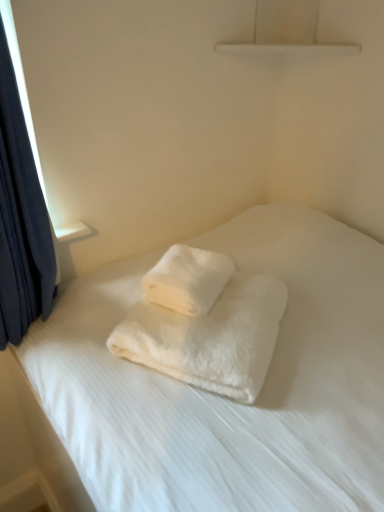
Question: Is white fluffy towel at center, which ranks as the 2th towel in bottom-to-top order, bigger than white fluffy towel at center, the second towel when ordered from top to bottom?

Choices:
 (A) yes
 (B) no

Answer: (B)

Question: Is white fluffy towel at center, which is the 1th towel from top to bottom, further to camera compared to white fluffy towel at center, the second towel when ordered from top to bottom?

Choices:
 (A) no
 (B) yes

Answer: (B)

Question: From a real-world perspective, is white fluffy towel at center, which is the 1th towel from top to bottom, positioned under white fluffy towel at center, the second towel when ordered from top to bottom, based on gravity?

Choices:
 (A) no
 (B) yes

Answer: (A)

Question: From the image's perspective, would you say white fluffy towel at center, which ranks as the 2th towel in bottom-to-top order, is shown under white fluffy towel at center, the second towel when ordered from top to bottom?

Choices:
 (A) yes
 (B) no

Answer: (B)

Question: Could you tell me if white fluffy towel at center, which is the 1th towel from top to bottom, is turned towards white fluffy towel at center, which is the first towel from bottom to top?

Choices:
 (A) yes
 (B) no

Answer: (B)

Question: From a real-world perspective, does white fluffy towel at center, which is the 1th towel from top to bottom, stand above white fluffy towel at center, the second towel when ordered from top to bottom?

Choices:
 (A) yes
 (B) no

Answer: (A)

Question: From a real-world perspective, is white fluffy towel at center, which is the first towel from bottom to top, located beneath white fluffy towels at center?

Choices:
 (A) no
 (B) yes

Answer: (A)

Question: Is white fluffy towels at center a part of white fluffy towel at center, which is the first towel from bottom to top?

Choices:
 (A) yes
 (B) no

Answer: (B)

Question: From the image's perspective, does white fluffy towel at center, which is the first towel from bottom to top, appear lower than white fluffy towels at center?

Choices:
 (A) no
 (B) yes

Answer: (A)

Question: Is white fluffy towel at center, the second towel when ordered from top to bottom, next to white fluffy towels at center?

Choices:
 (A) yes
 (B) no

Answer: (B)

Question: Is white fluffy towel at center, which is the first towel from bottom to top, further to camera compared to white fluffy towels at center?

Choices:
 (A) no
 (B) yes

Answer: (B)

Question: Is white fluffy towel at center, which is the first towel from bottom to top, closer to camera compared to white fluffy towels at center?

Choices:
 (A) no
 (B) yes

Answer: (A)

Question: Considering the relative sizes of white fluffy towel at center, which is the first towel from bottom to top, and white fluffy towel at center, which is the 1th towel from top to bottom, in the image provided, is white fluffy towel at center, which is the first towel from bottom to top, thinner than white fluffy towel at center, which is the 1th towel from top to bottom,?

Choices:
 (A) yes
 (B) no

Answer: (B)